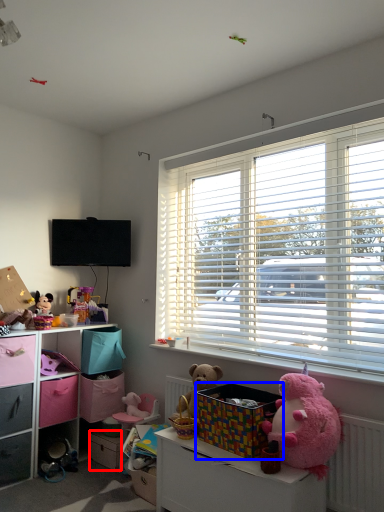
Question: Which point is closer to the camera, drawer (highlighted by a red box) or storage box (highlighted by a blue box)?

Choices:
 (A) drawer
 (B) storage box

Answer: (B)